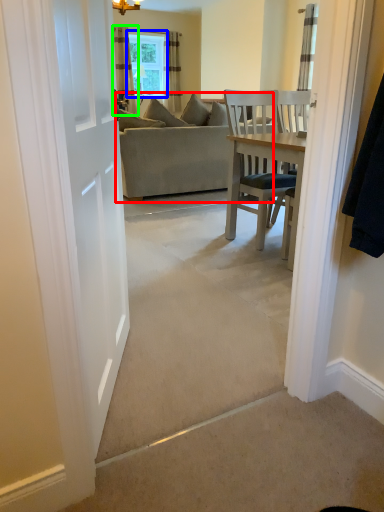
Question: Considering the real-world distances, which object is farthest from studio couch (highlighted by a red box)? window (highlighted by a blue box) or curtain (highlighted by a green box)?

Choices:
 (A) window
 (B) curtain

Answer: (A)